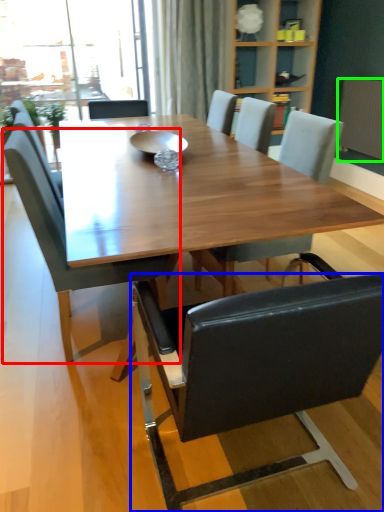
Question: Which object is the farthest from chair (highlighted by a red box)? Choose among these: chair (highlighted by a blue box) or radiator (highlighted by a green box).

Choices:
 (A) chair
 (B) radiator

Answer: (B)